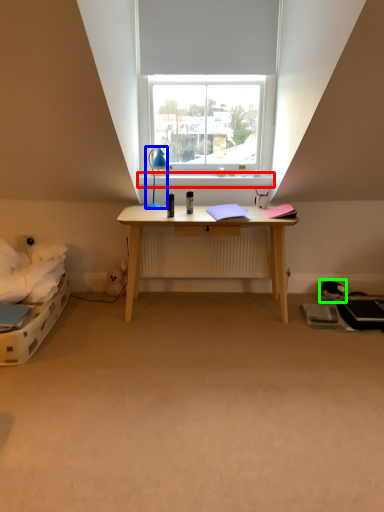
Question: Based on their relative distances, which object is farther from window sill (highlighted by a red box)? Choose from lamp (highlighted by a blue box) and toy (highlighted by a green box).

Choices:
 (A) lamp
 (B) toy

Answer: (B)